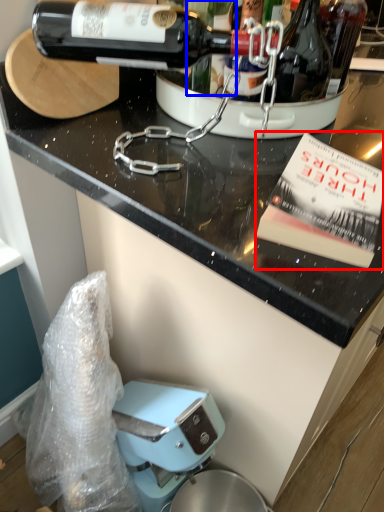
Question: Among these objects, which one is farthest to the camera, paperback book (highlighted by a red box) or wine (highlighted by a blue box)?

Choices:
 (A) paperback book
 (B) wine

Answer: (B)